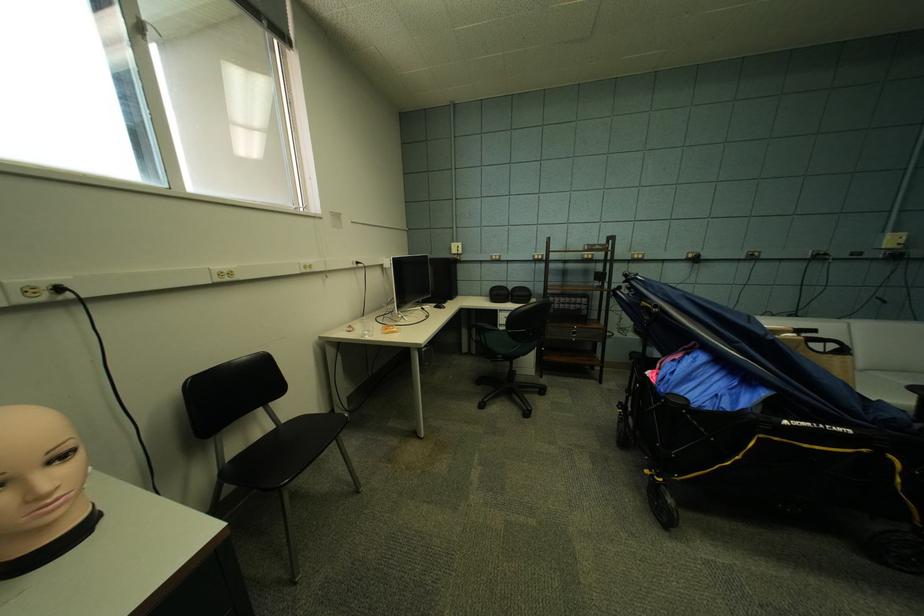
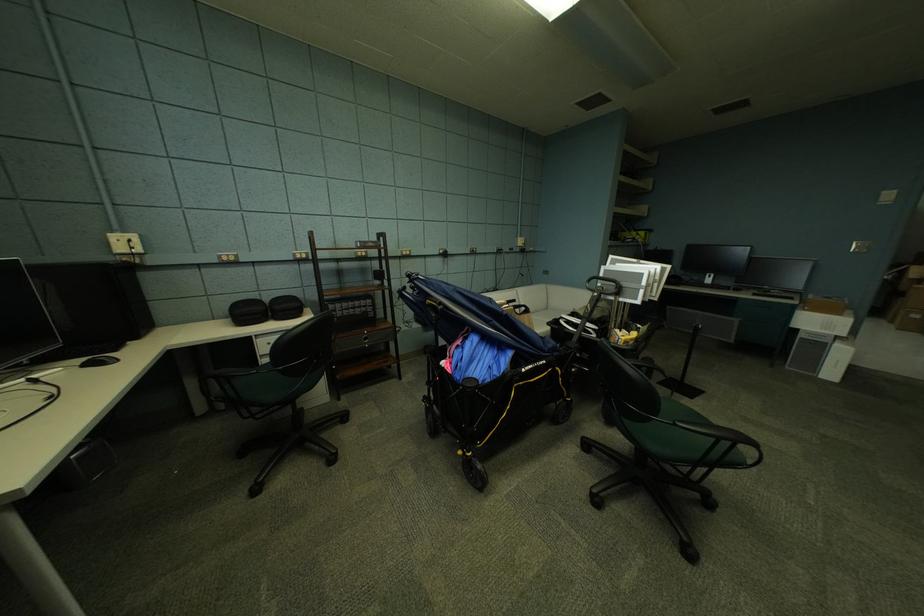
Question: Based on the continuous images, in which direction is the camera rotating? Reply with the corresponding letter.

Choices:
 (A) Left
 (B) Right
 (C) Up
 (D) Down

Answer: (B)